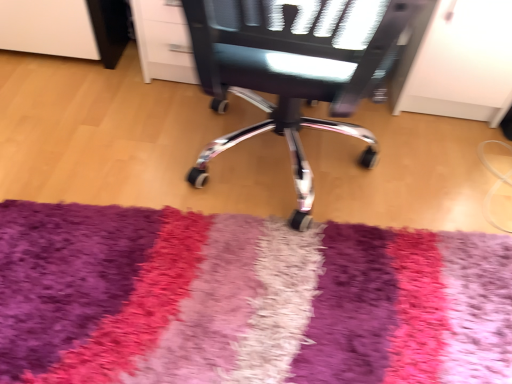
What do you see at coordinates (246, 300) in the screenshot?
I see `shaggy multicolor rug at center` at bounding box center [246, 300].

Locate an element on the screen. This screenshot has height=384, width=512. shaggy multicolor rug at center is located at coordinates (246, 300).

Locate an element on the screen. This screenshot has height=384, width=512. metallic mesh chair at center is located at coordinates (294, 68).

Describe the element at coordinates (294, 68) in the screenshot. The image size is (512, 384). I see `metallic mesh chair at center` at that location.

This screenshot has height=384, width=512. I want to click on shaggy multicolor rug at center, so click(x=246, y=300).

Which is more to the right, shaggy multicolor rug at center or metallic mesh chair at center?

metallic mesh chair at center.

From the picture: Does shaggy multicolor rug at center lie in front of metallic mesh chair at center?

No, shaggy multicolor rug at center is behind metallic mesh chair at center.

Looking at this image, which is nearer, (194, 328) or (265, 80)?

Point (194, 328) is positioned farther from the camera compared to point (265, 80).

From the image's perspective, is shaggy multicolor rug at center located above or below metallic mesh chair at center?

shaggy multicolor rug at center is below metallic mesh chair at center.

From a real-world perspective, relative to metallic mesh chair at center, is shaggy multicolor rug at center vertically above or below?

From a real-world perspective, shaggy multicolor rug at center is physically below metallic mesh chair at center.

Between shaggy multicolor rug at center and metallic mesh chair at center, which one has smaller width?

With smaller width is shaggy multicolor rug at center.

Can you confirm if shaggy multicolor rug at center is shorter than metallic mesh chair at center?

Yes, shaggy multicolor rug at center is shorter than metallic mesh chair at center.

Which of these two, shaggy multicolor rug at center or metallic mesh chair at center, is smaller?

Smaller between the two is shaggy multicolor rug at center.

Is shaggy multicolor rug at center inside the boundaries of metallic mesh chair at center, or outside?

shaggy multicolor rug at center exists outside the volume of metallic mesh chair at center.

Is shaggy multicolor rug at center directly adjacent to metallic mesh chair at center?

No.

Could you tell me if shaggy multicolor rug at center is facing metallic mesh chair at center?

No, shaggy multicolor rug at center does not turn towards metallic mesh chair at center.

How many degrees apart are the facing directions of shaggy multicolor rug at center and metallic mesh chair at center?

A: The angle between the facing direction of shaggy multicolor rug at center and the facing direction of metallic mesh chair at center is 173 degrees.

Measure the distance between shaggy multicolor rug at center and metallic mesh chair at center.

A distance of 37.00 centimeters exists between shaggy multicolor rug at center and metallic mesh chair at center.

The image size is (512, 384). In the image, there is a shaggy multicolor rug at center. What are the coordinates of `chair above it (from the image's perspective)` in the screenshot? It's located at (294, 68).

From the picture: Considering the positions of objects metallic mesh chair at center and shaggy multicolor rug at center in the image provided, who is more to the right, metallic mesh chair at center or shaggy multicolor rug at center?

metallic mesh chair at center is more to the right.

In the image, is metallic mesh chair at center positioned in front of or behind shaggy multicolor rug at center?

metallic mesh chair at center is positioned closer to the viewer than shaggy multicolor rug at center.

Considering the positions of point (339, 40) and point (386, 251), is point (339, 40) closer or farther from the camera than point (386, 251)?

Point (339, 40) appears to be closer to the viewer than point (386, 251).

From the image's perspective, which object appears higher, metallic mesh chair at center or shaggy multicolor rug at center?

From the image's view, metallic mesh chair at center is above.

From a real-world perspective, is metallic mesh chair at center located higher than shaggy multicolor rug at center?

Indeed, from a real-world perspective, metallic mesh chair at center stands above shaggy multicolor rug at center.

Looking at this image, can you confirm if metallic mesh chair at center is thinner than shaggy multicolor rug at center?

Incorrect, the width of metallic mesh chair at center is not less than that of shaggy multicolor rug at center.

Who is taller, metallic mesh chair at center or shaggy multicolor rug at center?

metallic mesh chair at center is taller.

Can you confirm if metallic mesh chair at center is bigger than shaggy multicolor rug at center?

Indeed, metallic mesh chair at center has a larger size compared to shaggy multicolor rug at center.

Is shaggy multicolor rug at center a part of metallic mesh chair at center?

Actually, shaggy multicolor rug at center is outside metallic mesh chair at center.

Are metallic mesh chair at center and shaggy multicolor rug at center making contact?

No, metallic mesh chair at center is not making contact with shaggy multicolor rug at center.

Is metallic mesh chair at center facing away from shaggy multicolor rug at center?

Yes, metallic mesh chair at center's orientation is away from shaggy multicolor rug at center.

I want to click on mat lying behind the metallic mesh chair at center, so click(246, 300).

Where is `mat behind the metallic mesh chair at center`? mat behind the metallic mesh chair at center is located at coordinates (246, 300).

You are a GUI agent. You are given a task and a screenshot of the screen. Output one action in this format:
    pyautogui.click(x=<x>, y=<y>)
    Task: Click on the mat that appears below the metallic mesh chair at center (from a real-world perspective)
    
    Given the screenshot: What is the action you would take?
    pyautogui.click(x=246, y=300)